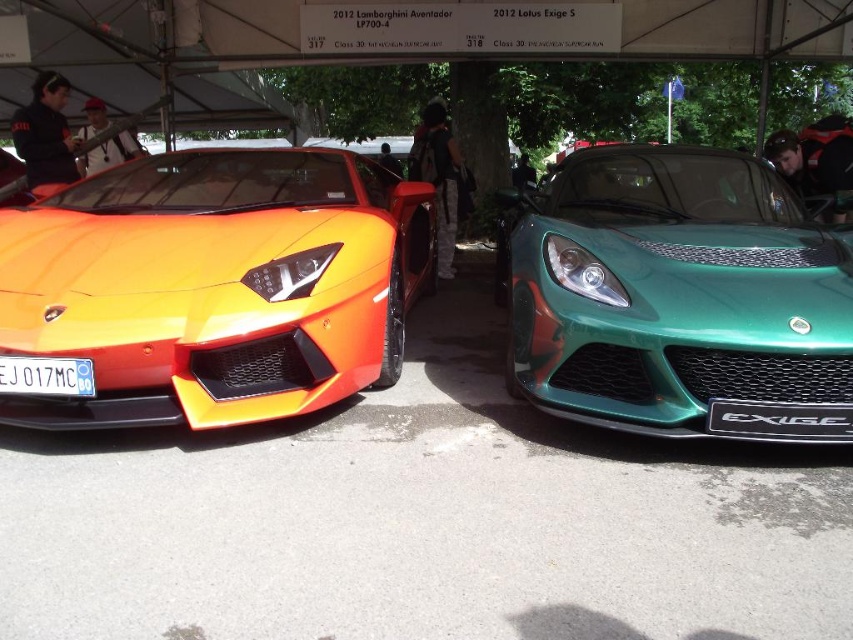
Can you confirm if orange matte sports car at left is positioned above white plastic license plate at center?

Yes.

Is orange matte sports car at left shorter than white plastic license plate at center?

No.

At what (x,y) coordinates should I click in order to perform the action: click on orange matte sports car at left. Please return your answer as a coordinate pair (x, y). This screenshot has width=853, height=640. Looking at the image, I should click on (213, 285).

Does orange matte/satin lamborghini aventador at left have a smaller size compared to metallic green sports car at right?

No, orange matte/satin lamborghini aventador at left is not smaller than metallic green sports car at right.

Is point (380, 196) positioned before point (583, 369)?

No, (380, 196) is further to viewer.

You are a GUI agent. You are given a task and a screenshot of the screen. Output one action in this format:
    pyautogui.click(x=<x>, y=<y>)
    Task: Click on the orange matte/satin lamborghini aventador at left
    
    Given the screenshot: What is the action you would take?
    pyautogui.click(x=213, y=285)

Is the position of metallic green sports car at right less distant than that of black matte at center?

Yes.

Does point (577, 372) come farther from viewer compared to point (822, 403)?

Yes.

Image resolution: width=853 pixels, height=640 pixels. Find the location of `metallic green sports car at right`. metallic green sports car at right is located at coordinates (677, 298).